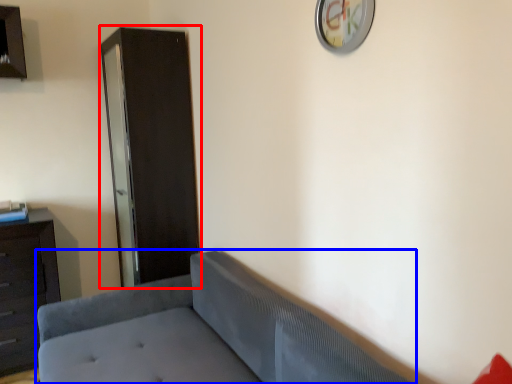
Question: Among these objects, which one is nearest to the camera, file cabinet (highlighted by a red box) or studio couch (highlighted by a blue box)?

Choices:
 (A) file cabinet
 (B) studio couch

Answer: (B)